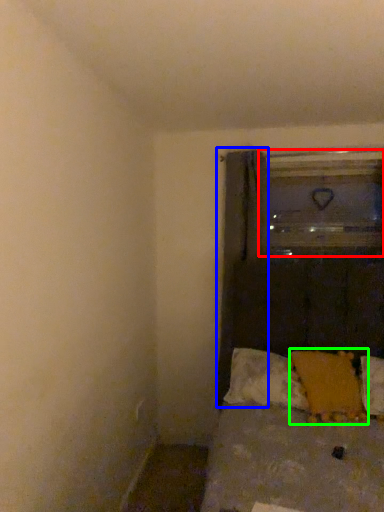
Question: Estimate the real-world distances between objects in this image. Which object is farther from glass door (highlighted by a red box), curtain (highlighted by a blue box) or pillow (highlighted by a green box)?

Choices:
 (A) curtain
 (B) pillow

Answer: (B)